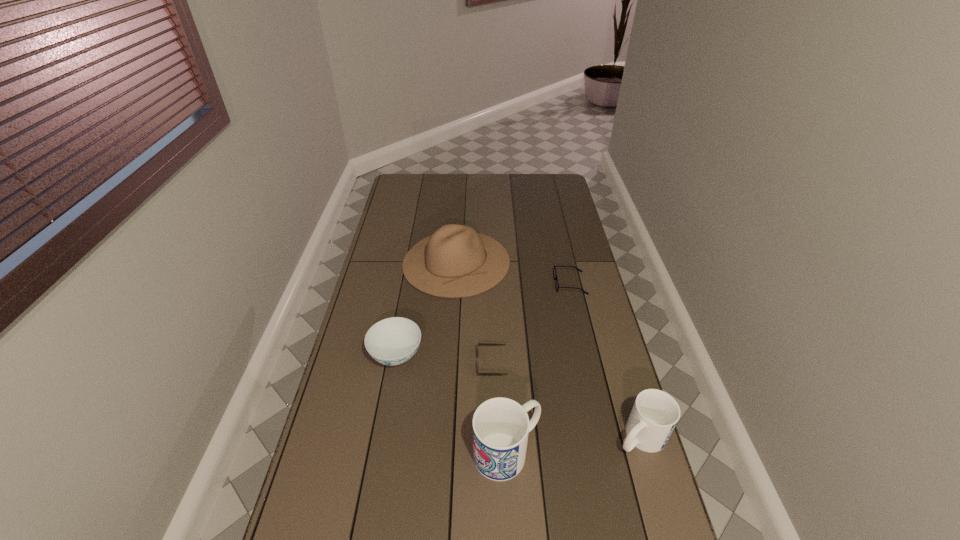
All mugs are currently evenly spaced. To continue this pattern, where would you add another mug on the left? Please point out a vacant spot. Please provide its 2D coordinates. Your answer should be formatted as a tuple, i.e. [(x, y)], where the tuple contains the x and y coordinates of a point satisfying the conditions above.

[(366, 467)]